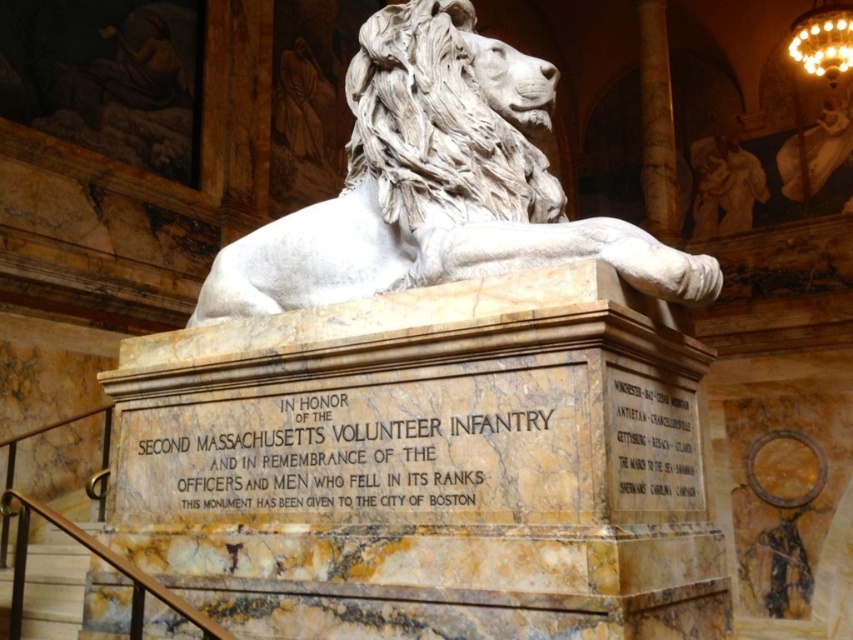
This screenshot has width=853, height=640. What do you see at coordinates (437, 184) in the screenshot?
I see `white marble lion at center` at bounding box center [437, 184].

Which is below, white marble lion at center or gold glass chandelier at upper right?

white marble lion at center is below.

Describe the element at coordinates (437, 184) in the screenshot. I see `white marble lion at center` at that location.

At what (x,y) coordinates should I click in order to perform the action: click on white marble lion at center. Please return your answer as a coordinate pair (x, y). Looking at the image, I should click on (x=437, y=184).

Which is above, gold metallic plaque at center or marble staircase at lower left?

gold metallic plaque at center is above.

Between point (645, 456) and point (78, 611), which one is positioned behind?

The point (78, 611) is more distant.

The image size is (853, 640). Identify the location of gold metallic plaque at center. (653, 444).

In order to click on gold metallic plaque at center in this screenshot , I will do `click(653, 444)`.

Who is more distant from viewer, (44, 545) or (827, 28)?

Positioned behind is point (827, 28).

Can you confirm if marble staircase at lower left is positioned below gold glass chandelier at upper right?

Yes, marble staircase at lower left is below gold glass chandelier at upper right.

Which is behind, point (10, 582) or point (830, 0)?

The point (830, 0) is behind.

Where is `marble staircase at lower left`? marble staircase at lower left is located at coordinates (53, 586).